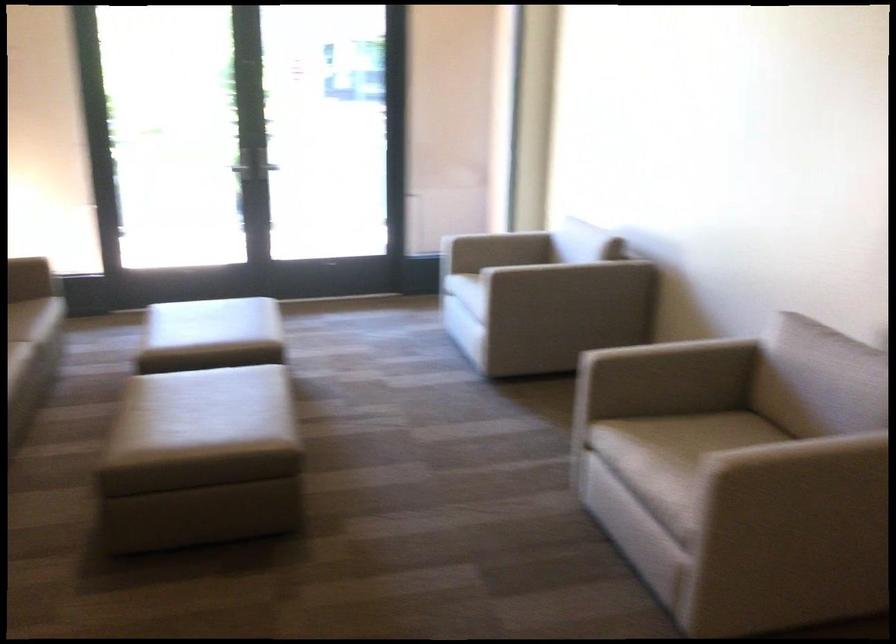
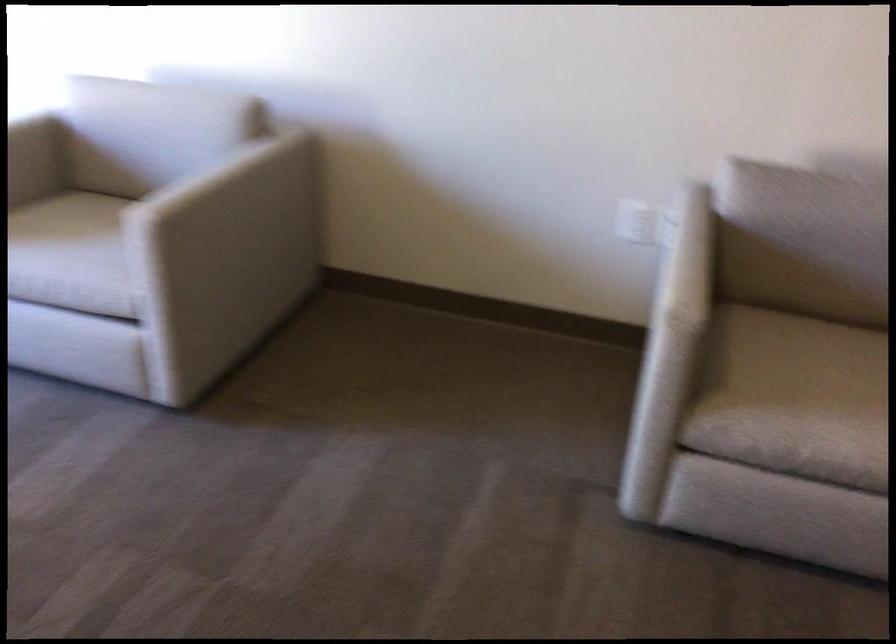
Find the pixel in the second image that matches [518,232] in the first image.

(28, 124)